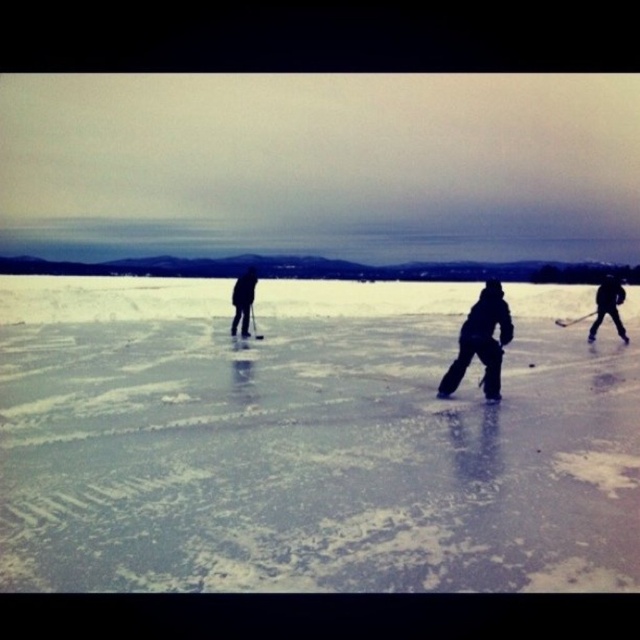
You are an ice hockey coach observing the game. You notice two pairs of skates on the ice. The dark gray ice skates at center and the black matte skates at right. Which pair has a wider blade to provide better stability?

The dark gray ice skates at center might be wider than black matte skates at right, so they could provide better stability.

You are a photographer aiming to capture the hockey players in the twilight scene. You notice the dark gray fabric jacket at center and the black matte hockey at center. Which object should you focus on if you want to highlight something taller in the composition?

The dark gray fabric jacket at center is taller than the black matte hockey at center, so focusing on it will highlight the taller object in the composition.